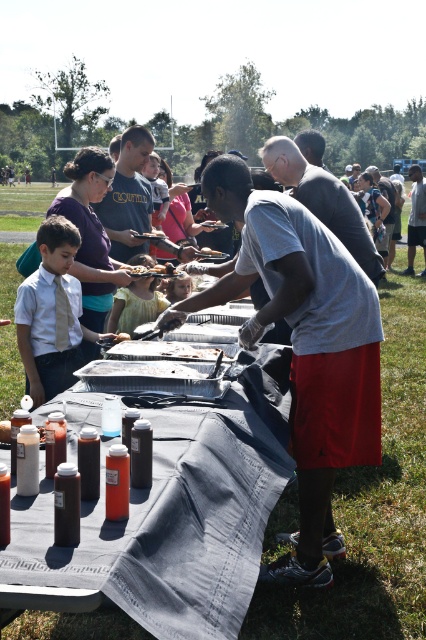
You are standing at the edge of the grassy field and see the black plastic table at center and the brown paper bag at center. Which object is closer to you?

The black plastic table at center is closer to the viewer than the brown paper bag at center.

What is located at the point with coordinates (178, 515) in the image?

The point at coordinates (178, 515) in the image indicates the location of the black plastic table at center.